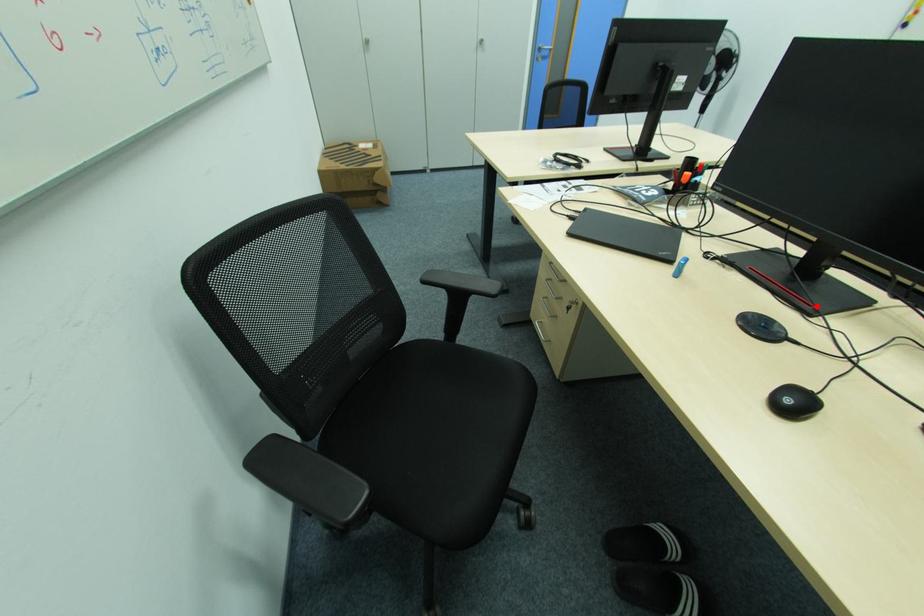
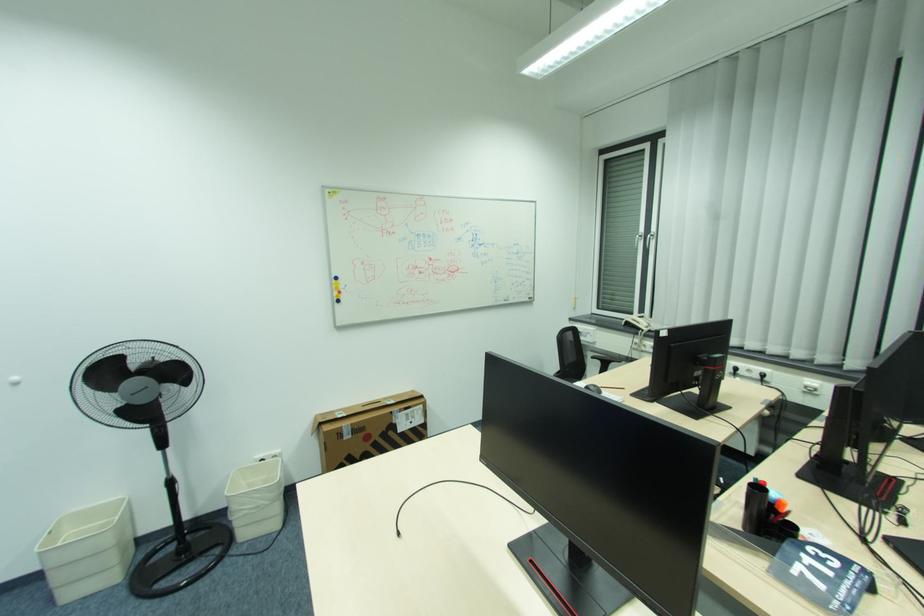
In the second image, find the point that corresponds to the highlighted location in the first image.

(896, 480)